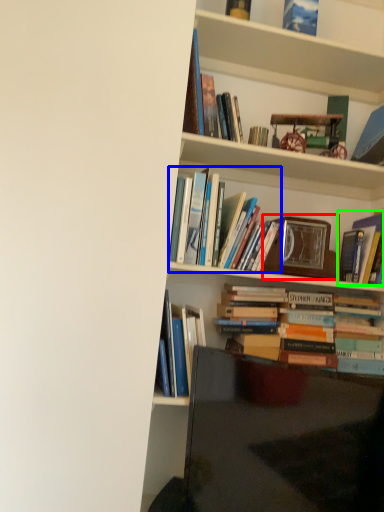
Question: Which is nearer to the picture frame (highlighted by a red box)? book (highlighted by a blue box) or book (highlighted by a green box).

Choices:
 (A) book
 (B) book

Answer: (B)